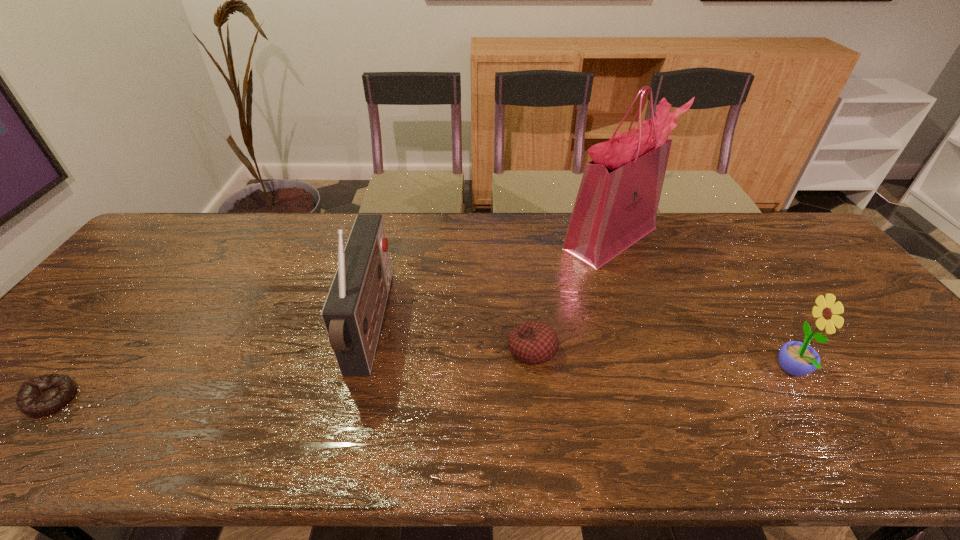
The height and width of the screenshot is (540, 960). Find the location of `free space between the fourth tallest object and the fourth object from right to left`. free space between the fourth tallest object and the fourth object from right to left is located at coordinates (451, 338).

The image size is (960, 540). I want to click on free point between the farther beanbag and the sunflower, so click(x=662, y=360).

Choose which object is the fourth nearest neighbor to the shorter beanbag. Please provide its 2D coordinates. Your answer should be formatted as a tuple, i.e. [(x, y)], where the tuple contains the x and y coordinates of a point satisfying the conditions above.

[(796, 358)]

Identify which object is the fourth closest to the farther beanbag. Please provide its 2D coordinates. Your answer should be formatted as a tuple, i.e. [(x, y)], where the tuple contains the x and y coordinates of a point satisfying the conditions above.

[(41, 396)]

The width and height of the screenshot is (960, 540). In order to click on free space in the image that satisfies the following two spatial constraints: 1. on the front panel of the fourth shortest object; 2. on the left side of the farther beanbag in this screenshot , I will do `click(365, 349)`.